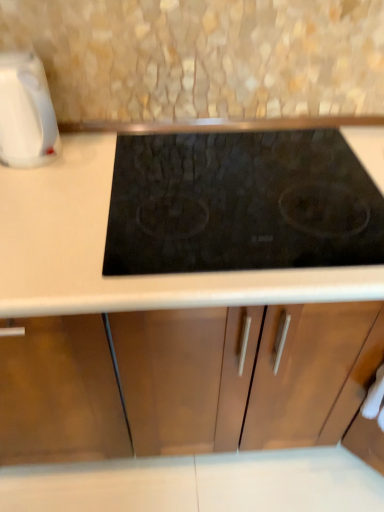
In order to click on white glossy kettle at left in this screenshot , I will do `click(26, 113)`.

What do you see at coordinates (26, 113) in the screenshot? The width and height of the screenshot is (384, 512). I see `white glossy kettle at left` at bounding box center [26, 113].

In order to face black glass cooktop at center, should I rotate leftwards or rightwards?

Turn right by 6.943 degrees to look at black glass cooktop at center.

What are the coordinates of `black glass cooktop at center` in the screenshot? It's located at (104, 246).

Image resolution: width=384 pixels, height=512 pixels. What do you see at coordinates (104, 246) in the screenshot?
I see `black glass cooktop at center` at bounding box center [104, 246].

Identify the location of white glossy kettle at left. (26, 113).

Which object is positioned more to the right, black glass cooktop at center or white glossy kettle at left?

black glass cooktop at center is more to the right.

Is the depth of black glass cooktop at center greater than that of white glossy kettle at left?

No, black glass cooktop at center is in front of white glossy kettle at left.

Which point is more distant from viewer, (196,285) or (25,87)?

The point (25,87) is more distant.

From the image's perspective, who appears lower, black glass cooktop at center or white glossy kettle at left?

black glass cooktop at center appears lower in the image.

From a real-world perspective, is black glass cooktop at center positioned above or below white glossy kettle at left?

From a real-world perspective, black glass cooktop at center is physically below white glossy kettle at left.

Is black glass cooktop at center thinner than white glossy kettle at left?

No, black glass cooktop at center is not thinner than white glossy kettle at left.

Can you confirm if black glass cooktop at center is taller than white glossy kettle at left?

Incorrect, the height of black glass cooktop at center is not larger of that of white glossy kettle at left.

Considering the sizes of black glass cooktop at center and white glossy kettle at left in the image, is black glass cooktop at center bigger or smaller than white glossy kettle at left?

Considering their sizes, black glass cooktop at center takes up more space than white glossy kettle at left.

Based on the photo, is black glass cooktop at center situated inside white glossy kettle at left or outside?

black glass cooktop at center is not enclosed by white glossy kettle at left.

Based on the photo, is black glass cooktop at center far away from white glossy kettle at left?

That's not correct — black glass cooktop at center is a little close to white glossy kettle at left.

Could you tell me if black glass cooktop at center is turned towards white glossy kettle at left?

No.

Identify the location of kitchen appliance above the black glass cooktop at center (from the image's perspective). The width and height of the screenshot is (384, 512). (26, 113).

Which object is positioned more to the left, white glossy kettle at left or black glass cooktop at center?

Positioned to the left is white glossy kettle at left.

Relative to black glass cooktop at center, is white glossy kettle at left in front or behind?

Visually, white glossy kettle at left is located behind black glass cooktop at center.

Does point (1, 142) lie in front of point (73, 197)?

No, (1, 142) is behind (73, 197).

From the image's perspective, is white glossy kettle at left under black glass cooktop at center?

No, from the image's perspective, white glossy kettle at left is not below black glass cooktop at center.

From a real-world perspective, is white glossy kettle at left positioned under black glass cooktop at center based on gravity?

No.

Considering the relative sizes of white glossy kettle at left and black glass cooktop at center in the image provided, is white glossy kettle at left thinner than black glass cooktop at center?

Yes, white glossy kettle at left is thinner than black glass cooktop at center.

Considering the sizes of objects white glossy kettle at left and black glass cooktop at center in the image provided, who is shorter, white glossy kettle at left or black glass cooktop at center?

With less height is black glass cooktop at center.

Does white glossy kettle at left have a larger size compared to black glass cooktop at center?

No.

Would you say white glossy kettle at left is outside black glass cooktop at center?

Indeed, white glossy kettle at left is completely outside black glass cooktop at center.

Is white glossy kettle at left next to black glass cooktop at center and touching it?

No, white glossy kettle at left is not beside black glass cooktop at center.

Is white glossy kettle at left oriented towards black glass cooktop at center?

No, white glossy kettle at left is not aimed at black glass cooktop at center.

You are a GUI agent. You are given a task and a screenshot of the screen. Output one action in this format:
    pyautogui.click(x=<x>, y=<y>)
    Task: Click on the countertop on the right of white glossy kettle at left
    
    Given the screenshot: What is the action you would take?
    pyautogui.click(x=104, y=246)

This screenshot has width=384, height=512. I want to click on kitchen appliance that appears on the left of black glass cooktop at center, so click(x=26, y=113).

The image size is (384, 512). What are the coordinates of `countertop that is below the white glossy kettle at left (from the image's perspective)` in the screenshot? It's located at (104, 246).